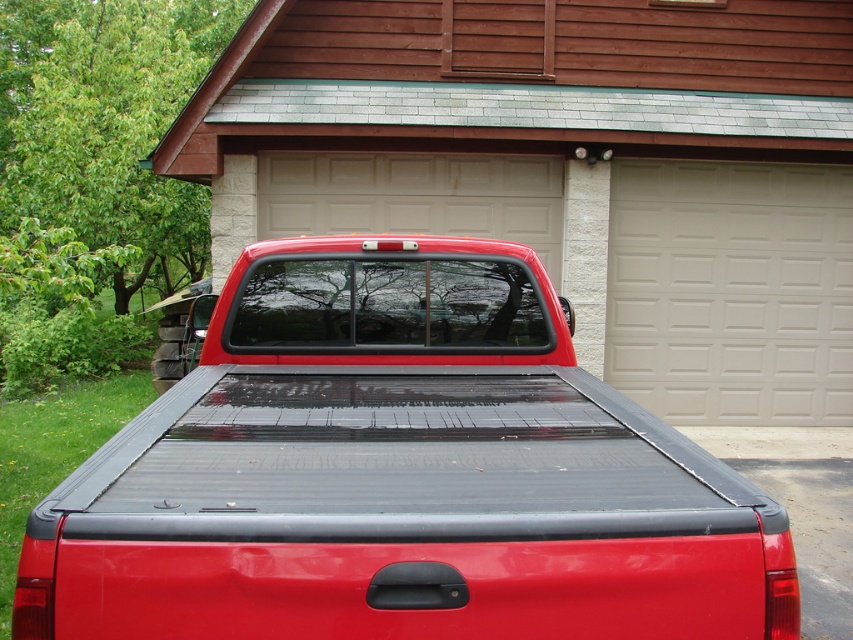
Question: Among these objects, which one is farthest from the camera?

Choices:
 (A) black rubber mat at lower right
 (B) white textured panel at center
 (C) matte black truck bed at center

Answer: (B)

Question: Is matte black truck bed at center behind black rubber mat at lower right?

Choices:
 (A) yes
 (B) no

Answer: (B)

Question: Based on their relative distances, which object is farther from the black rubber mat at lower right?

Choices:
 (A) white textured panel at center
 (B) matte black truck bed at center

Answer: (B)

Question: Can you confirm if matte black truck bed at center is thinner than white textured panel at center?

Choices:
 (A) yes
 (B) no

Answer: (A)

Question: Does matte black truck bed at center have a larger size compared to black rubber mat at lower right?

Choices:
 (A) no
 (B) yes

Answer: (B)

Question: Which of the following is the farthest from the observer?

Choices:
 (A) (805, 531)
 (B) (527, 552)

Answer: (A)